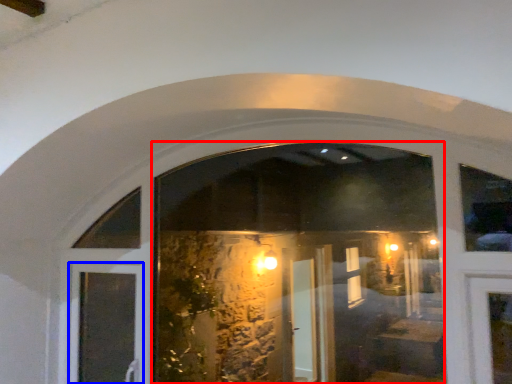
Question: Which point is further to the camera, shop window (highlighted by a red box) or door (highlighted by a blue box)?

Choices:
 (A) shop window
 (B) door

Answer: (B)